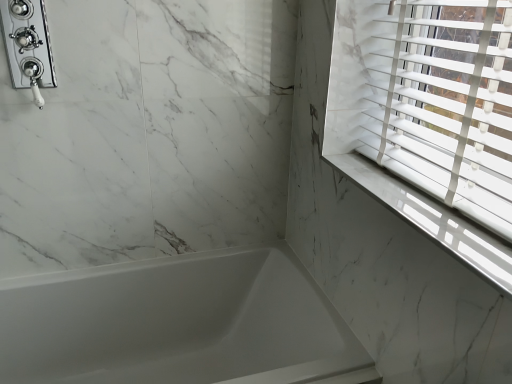
Locate an element on the screen. free space above white marble window sill at upper right (from a real-world perspective) is located at coordinates (412, 203).